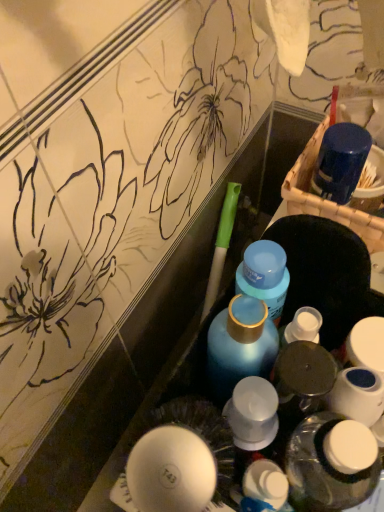
Question: Could you tell me if white plastic bottle at center, the 1th bottle when ordered from bottom to top, is facing blue matte bottle at center, arranged as the second bottle when viewed from the top?

Choices:
 (A) yes
 (B) no

Answer: (B)

Question: From the image's perspective, is white plastic bottle at center, the 1th bottle when ordered from bottom to top, above blue matte bottle at center, arranged as the second bottle when viewed from the top?

Choices:
 (A) yes
 (B) no

Answer: (B)

Question: Is white plastic bottle at center, the 1th bottle when ordered from bottom to top, not within blue matte bottle at center, arranged as the second bottle when viewed from the top?

Choices:
 (A) yes
 (B) no

Answer: (A)

Question: From a real-world perspective, does white plastic bottle at center, arranged as the third bottle when viewed from the top, sit lower than blue matte bottle at center, which appears as the 2th bottle when ordered from the bottom?

Choices:
 (A) yes
 (B) no

Answer: (A)

Question: Is white plastic bottle at center, arranged as the third bottle when viewed from the top, closer to the viewer compared to blue matte bottle at center, which appears as the 2th bottle when ordered from the bottom?

Choices:
 (A) yes
 (B) no

Answer: (A)

Question: Can you confirm if white plastic bottle at center, arranged as the third bottle when viewed from the top, is positioned to the right of blue matte bottle at center, which appears as the 2th bottle when ordered from the bottom?

Choices:
 (A) yes
 (B) no

Answer: (A)

Question: Considering the relative sizes of blue matte bottle at center, which appears as the 2th bottle when ordered from the bottom, and white plastic bottle at center, the 1th bottle when ordered from bottom to top, in the image provided, is blue matte bottle at center, which appears as the 2th bottle when ordered from the bottom, wider than white plastic bottle at center, the 1th bottle when ordered from bottom to top,?

Choices:
 (A) yes
 (B) no

Answer: (B)

Question: Could you tell me if blue matte bottle at center, which appears as the 2th bottle when ordered from the bottom, is facing white plastic bottle at center, arranged as the third bottle when viewed from the top?

Choices:
 (A) no
 (B) yes

Answer: (A)

Question: Considering the relative sizes of blue matte bottle at center, which appears as the 2th bottle when ordered from the bottom, and white plastic bottle at center, arranged as the third bottle when viewed from the top, in the image provided, is blue matte bottle at center, which appears as the 2th bottle when ordered from the bottom, taller than white plastic bottle at center, arranged as the third bottle when viewed from the top,?

Choices:
 (A) no
 (B) yes

Answer: (A)

Question: From a real-world perspective, is blue matte bottle at center, arranged as the second bottle when viewed from the top, physically below white plastic bottle at center, arranged as the third bottle when viewed from the top?

Choices:
 (A) yes
 (B) no

Answer: (B)

Question: From the image's perspective, would you say blue matte bottle at center, arranged as the second bottle when viewed from the top, is shown under white plastic bottle at center, the 1th bottle when ordered from bottom to top?

Choices:
 (A) yes
 (B) no

Answer: (B)

Question: From the image's perspective, is blue matte bottle at center, which appears as the 2th bottle when ordered from the bottom, located above white plastic bottle at center, the 1th bottle when ordered from bottom to top?

Choices:
 (A) yes
 (B) no

Answer: (A)

Question: Does white plastic bottle at center have a lesser height compared to blue matte bottle at center, arranged as the second bottle when viewed from the top?

Choices:
 (A) no
 (B) yes

Answer: (B)